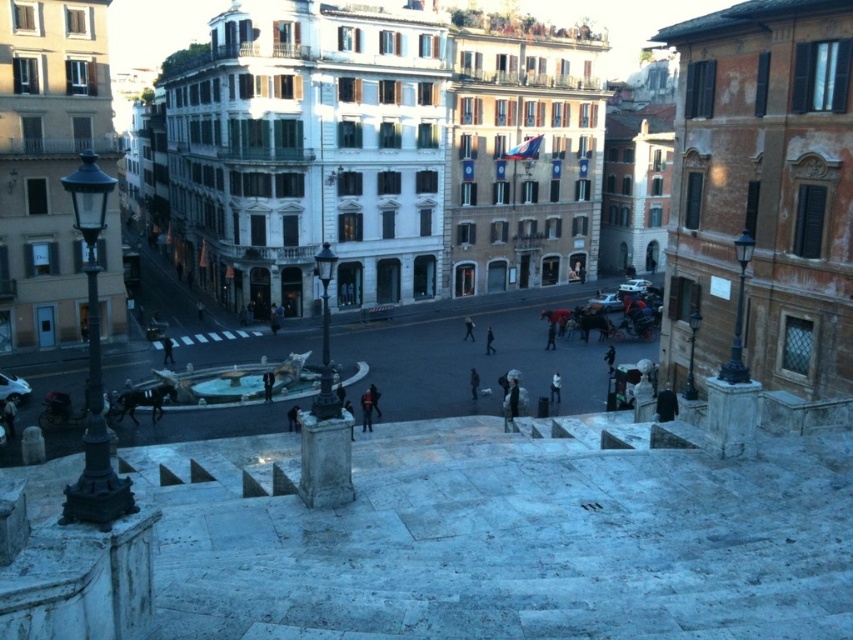
You are standing at the Spanish Steps in Rome and want to take a photo that includes both the point at coordinate (674, 396) and the point at coordinate (369, 392). Since you want the closer point to be in focus, which coordinate should you focus on?

Point (674, 396) is closer to the camera than point (369, 392), so you should focus on point (674, 396) to ensure it is in focus.

You are a photographer planning to take a photo of the Spanish Steps. You want to ensure both the black fabric person at lower right and the dark blue jeans at center are clearly visible. Given their sizes, which one might you need to adjust your focus on to capture more detail?

The black fabric person at lower right has a larger size compared to the dark blue jeans at center, so you should focus more on the dark blue jeans at center to ensure its details are captured clearly.

In the scene shown: You are standing at the top of the Spanish Steps in Rome and see a black fabric person at lower right and dark blue jeans at center. Which of these two objects is positioned higher up in the scene?

The black fabric person at lower right is located above the dark blue jeans at center, so the black fabric person at lower right is positioned higher up in the scene.